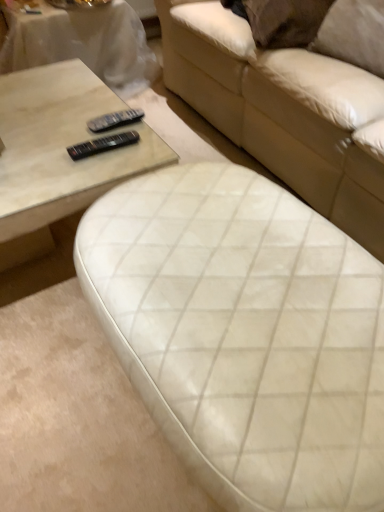
You are a GUI agent. You are given a task and a screenshot of the screen. Output one action in this format:
    pyautogui.click(x=<x>, y=<y>)
    Task: Click on the free space above matte glass coffee table at center (from a real-world perspective)
    
    Given the screenshot: What is the action you would take?
    pyautogui.click(x=54, y=118)